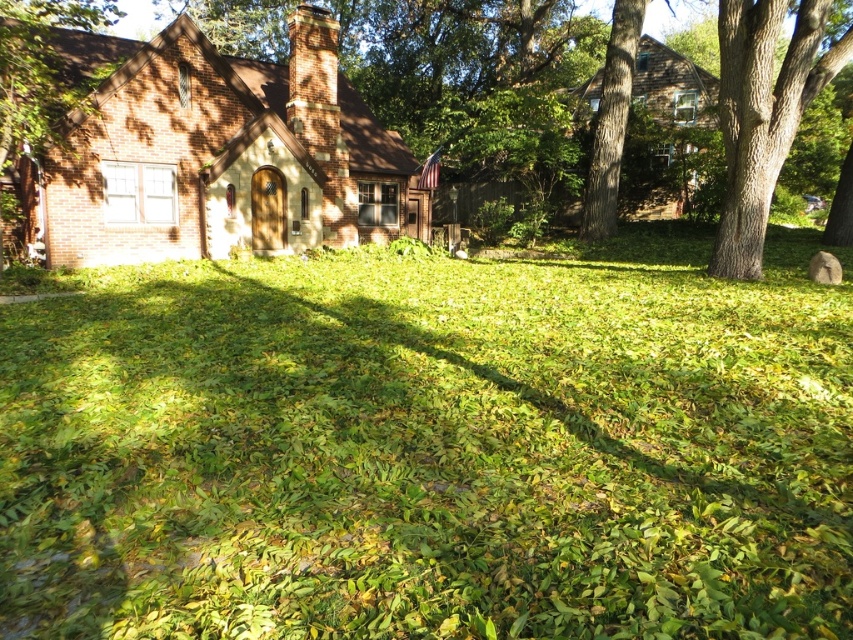
You are standing in the suburban residential scene. You see the green leafy grass at center and the brown rough bark tree at upper right. Which object is nearer to you?

The green leafy grass at center is closer to the viewer than the brown rough bark tree at upper right.

You are a landscape architect planning to install a new sprinkler system. The sprinkler has a maximum range of 18 meters. You need to place it in such a way that it can water both the brick wall at left and the brown rough bark tree at upper right. Based on the scene description, can the sprinkler effectively cover both areas?

The distance between the brick wall at left and the brown rough bark tree at upper right is 17.90 meters, which is just under the sprinkler system maximum range of 18 meters. Therefore, the sprinkler can effectively cover both areas.

You are standing at the center of the image and want to walk towards the brick wall at left. In which direction should you head?

The brick wall at left is located at point 0.108 on the x and 0.046 on the y axis, so you should head to the left and slightly downward from your current position to reach it.